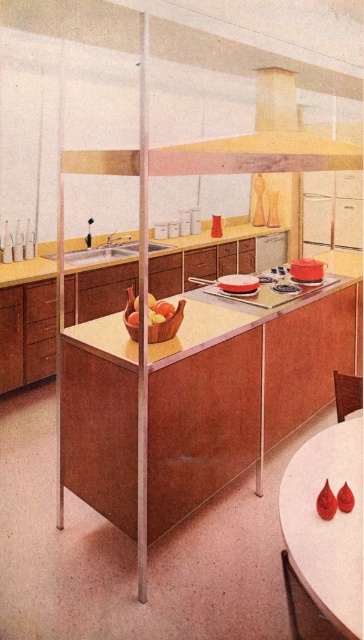
Question: Does white glossy round table at lower right appear over yellow matte exhaust hood at upper center?

Choices:
 (A) yes
 (B) no

Answer: (B)

Question: Can you confirm if wooden table at center is bigger than wooden chair at lower right?

Choices:
 (A) no
 (B) yes

Answer: (B)

Question: Which object appears farthest from the camera in this image?

Choices:
 (A) shiny golden apples at center
 (B) wooden table at center
 (C) wooden chair at lower right
 (D) white glossy round table at lower right

Answer: (C)

Question: Which of the following is the closest to the observer?

Choices:
 (A) satin nickel sink at center
 (B) wooden table at center
 (C) matte red pot at center
 (D) white glossy round table at lower right

Answer: (D)

Question: Can you confirm if satin nickel sink at center is positioned to the right of shiny golden apples at center?

Choices:
 (A) yes
 (B) no

Answer: (B)

Question: Which object is positioned closest to the shiny golden apples at center?

Choices:
 (A) yellow matte exhaust hood at upper center
 (B) matte red pot at center
 (C) white glossy round table at lower right
 (D) wooden chair at lower right

Answer: (D)